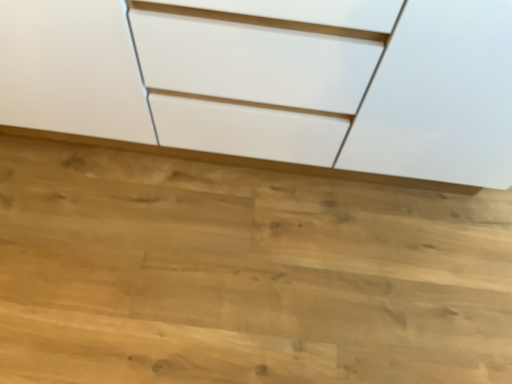
Find the location of a particular element. The height and width of the screenshot is (384, 512). white glossy chest of drawers at upper center is located at coordinates (327, 84).

This screenshot has height=384, width=512. What do you see at coordinates (327, 84) in the screenshot?
I see `white glossy chest of drawers at upper center` at bounding box center [327, 84].

Measure the distance between white glossy chest of drawers at upper center and camera.

white glossy chest of drawers at upper center and camera are 27.70 inches apart from each other.

You are a GUI agent. You are given a task and a screenshot of the screen. Output one action in this format:
    pyautogui.click(x=<x>, y=<y>)
    Task: Click on the white glossy chest of drawers at upper center
    The image size is (512, 384).
    Given the screenshot: What is the action you would take?
    pyautogui.click(x=327, y=84)